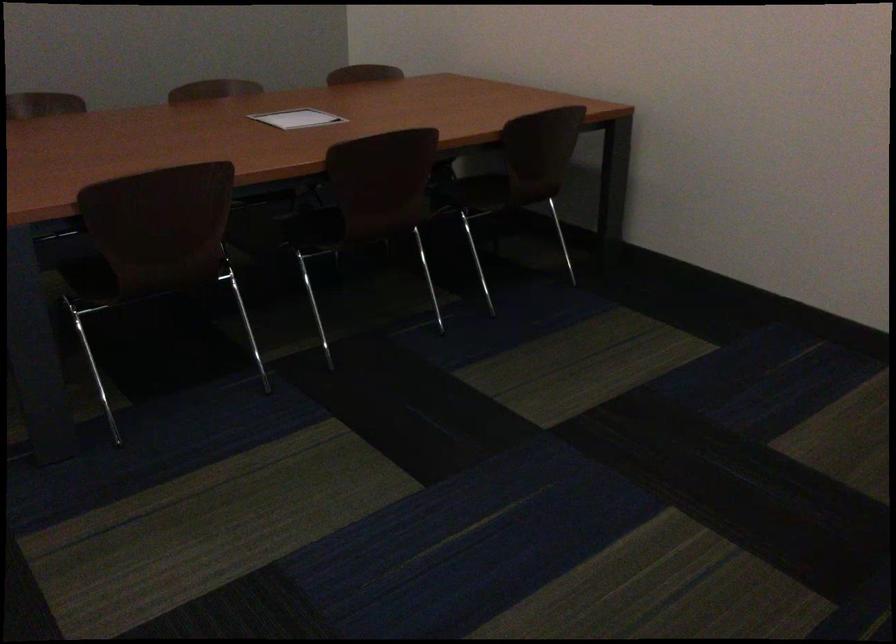
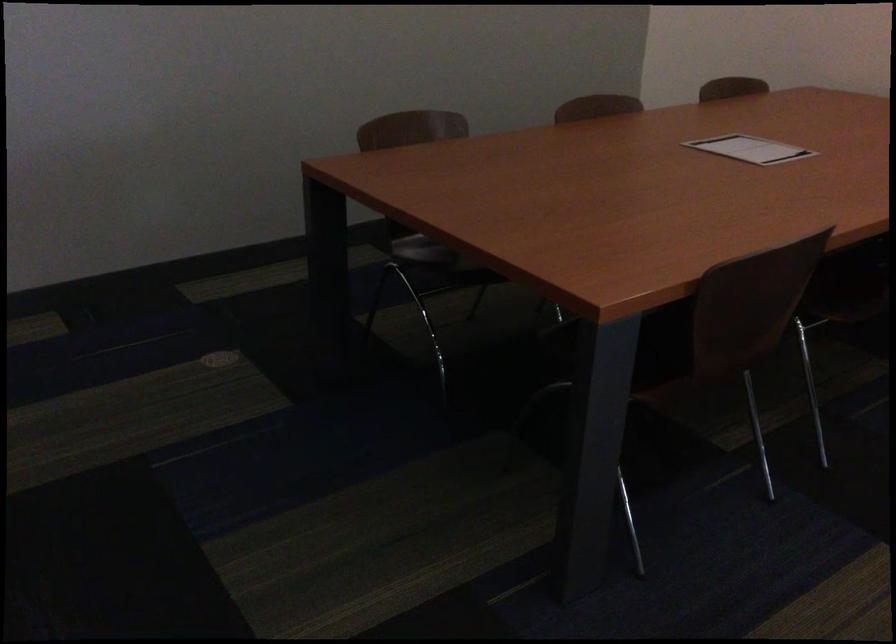
Locate, in the second image, the point that corresponds to point (134, 269) in the first image.

(710, 357)